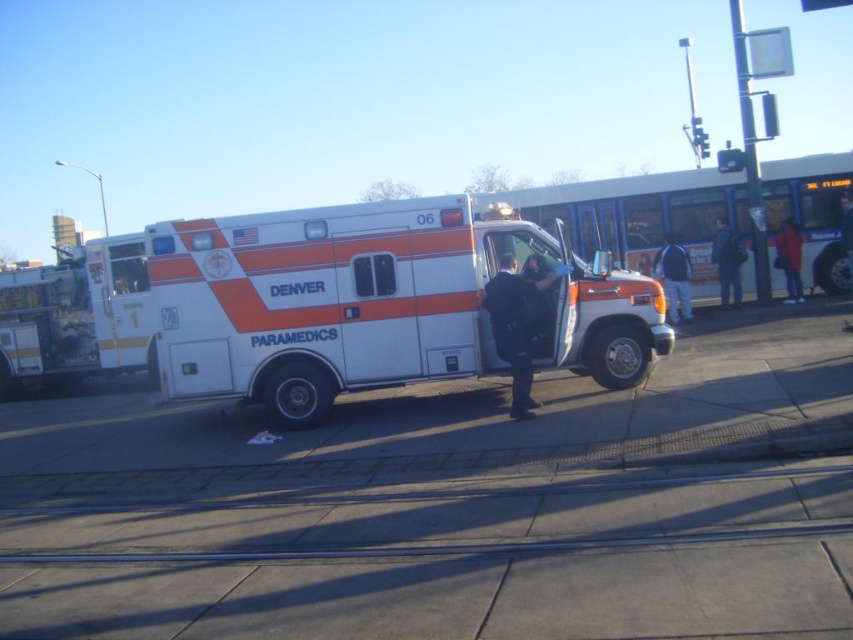
Question: Considering the relative positions of white glossy ambulance at center and dark blue jacket at center in the image provided, where is white glossy ambulance at center located with respect to dark blue jacket at center?

Choices:
 (A) below
 (B) above

Answer: (A)

Question: Which point is closer to the camera taking this photo?

Choices:
 (A) click(x=608, y=269)
 (B) click(x=503, y=282)
 (C) click(x=723, y=234)

Answer: (B)

Question: Can you confirm if dark blue jacket at center is positioned to the left of dark blue uniform at center?

Choices:
 (A) no
 (B) yes

Answer: (B)

Question: Does dark blue jacket at center lie in front of dark blue uniform at center?

Choices:
 (A) yes
 (B) no

Answer: (B)

Question: Which object appears closest to the camera in this image?

Choices:
 (A) red fabric jacket at right
 (B) dark blue uniform at center
 (C) black leather jacket at center

Answer: (C)

Question: Which is farther from the dark blue jacket at right?

Choices:
 (A) dark blue uniform at center
 (B) red fabric jacket at right

Answer: (A)